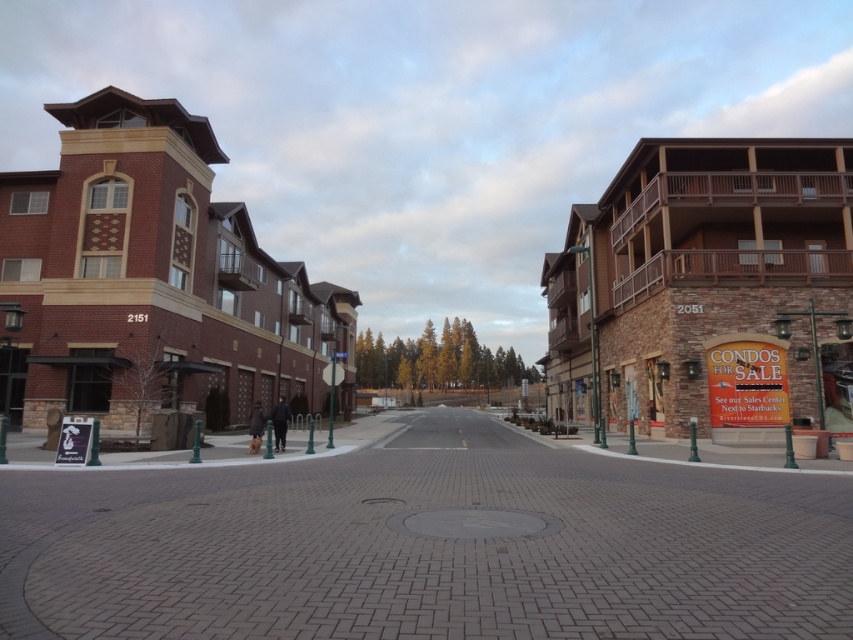
Looking at this image, you are standing at the point marked by the coordinates point (167, 284). Looking around, you see the brick building at center. Which direction should you face to look directly at the brick building at center?

You are already facing the brick building at center because you are standing at the point that represents its location.

Based on the photo, you are a delivery person trying to navigate between the brick building at center and the brown stone building at right. Which building should you avoid if you need to pass under low hanging power lines?

The brick building at center is much taller than the brown stone building at right. Since the brick building at center is taller, it is more likely to have power lines that are higher above the ground. Therefore, you should avoid the brown stone building at right to pass under low hanging power lines safely.